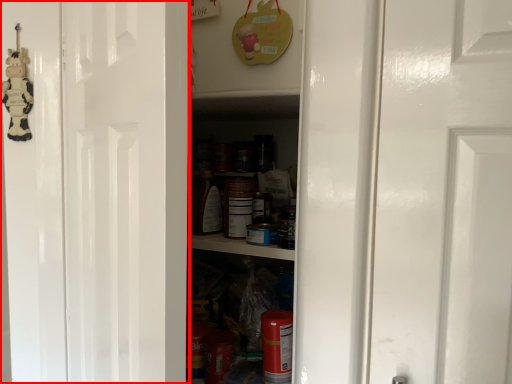
Question: Where is door (annotated by the red box) located in relation to toy in the image?

Choices:
 (A) left
 (B) right

Answer: (B)